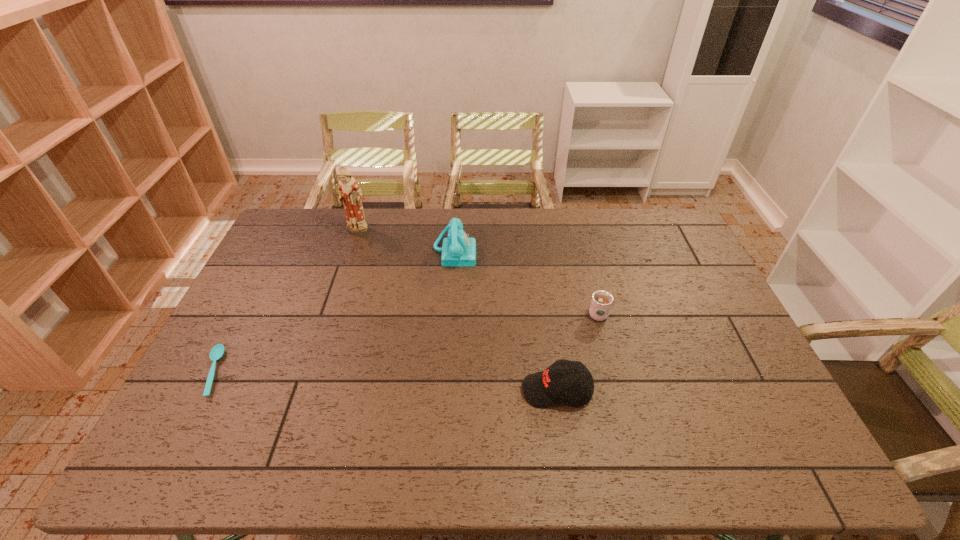
Where is `vacant space that satisfies the following two spatial constraints: 1. on the side with the handle of the rightmost object; 2. on the dial of the fourth shortest object`? vacant space that satisfies the following two spatial constraints: 1. on the side with the handle of the rightmost object; 2. on the dial of the fourth shortest object is located at coordinates (582, 252).